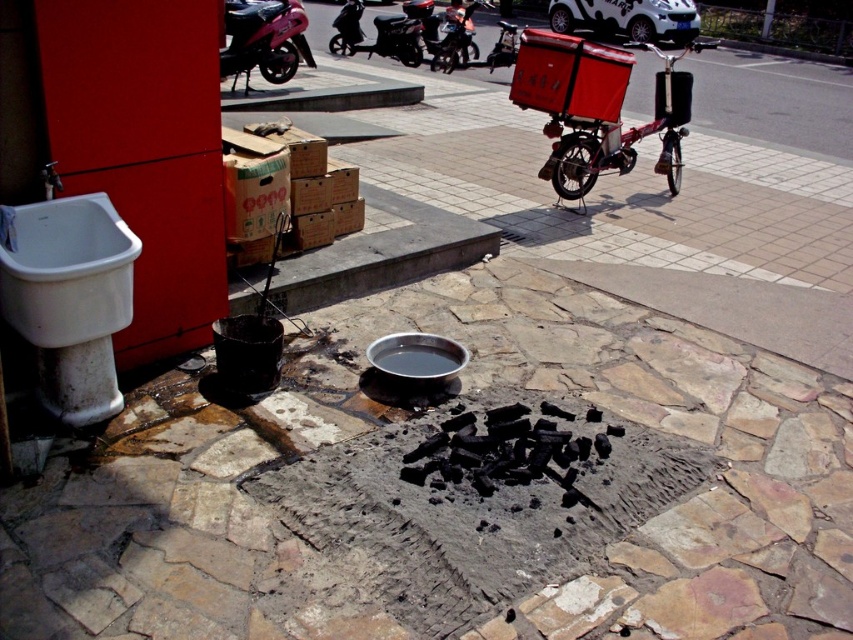
Question: Does metallic pink motorcycle at upper left have a greater width compared to metallic silver motorcycle at center?

Choices:
 (A) no
 (B) yes

Answer: (B)

Question: Which point is closer to the camera?

Choices:
 (A) shiny black motorcycle at upper center
 (B) smooth stone pavement at center
 (C) metallic silver motorcycle at center
 (D) metallic pink motorcycle at upper left

Answer: (B)

Question: Is the position of white matte sink at lower left less distant than that of shiny black motorcycle at upper center?

Choices:
 (A) no
 (B) yes

Answer: (B)

Question: Estimate the real-world distances between objects in this image. Which object is closer to the smooth stone pavement at center?

Choices:
 (A) shiny black motorcycle at upper center
 (B) metallic silver motorcycle at center
 (C) white matte sink at lower left
 (D) metallic pink motorcycle at upper left

Answer: (C)

Question: Does white matte sink at lower left appear on the left side of metallic silver motorcycle at center?

Choices:
 (A) yes
 (B) no

Answer: (A)

Question: Which point is farther from the camera taking this photo?

Choices:
 (A) (345, 38)
 (B) (306, 60)

Answer: (A)